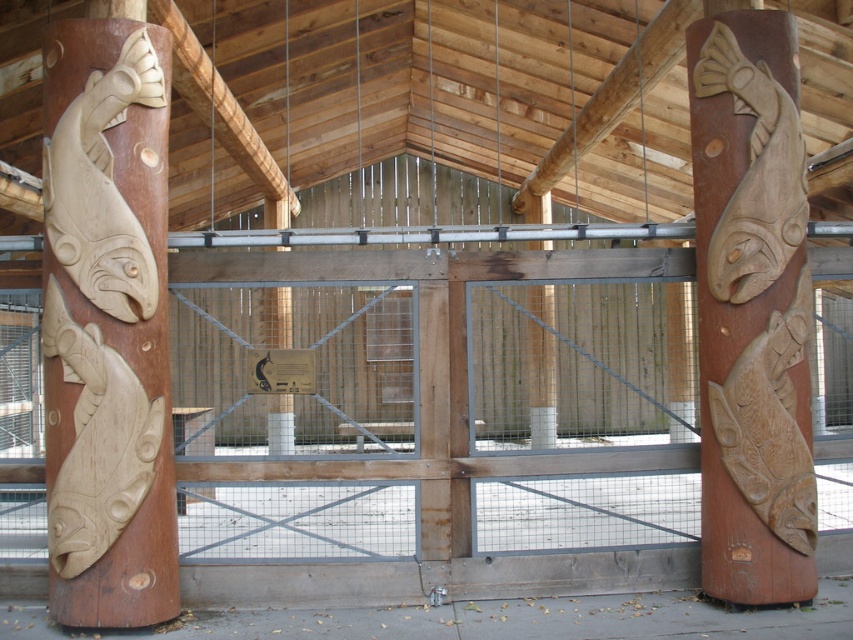
You are standing at the entrance of the exhibit and want to touch both the natural wood fish at left and the wooden carved fish at right. Which one can you reach first without moving your position?

The natural wood fish at left can be reached first because it is closer to the viewer than the wooden carved fish at right.

You are standing at the entrance of the exhibit and want to touch the natural wood fish at left. If your arm can reach up to 2 feet, can you reach it?

The natural wood fish at left is 21.46 feet away from camera. Since your arm can only reach up to 2 feet, you cannot reach it.

You are an architect designing a new exhibit entrance and need to ensure that the natural wood fish at left and wooden carved fish at right are visible from the main pathway. Given that the pathway is at the same level as the entrance, which fish will appear taller to visitors approaching from the front?

The wooden carved fish at right will appear taller because it is taller than the natural wood fish at left.